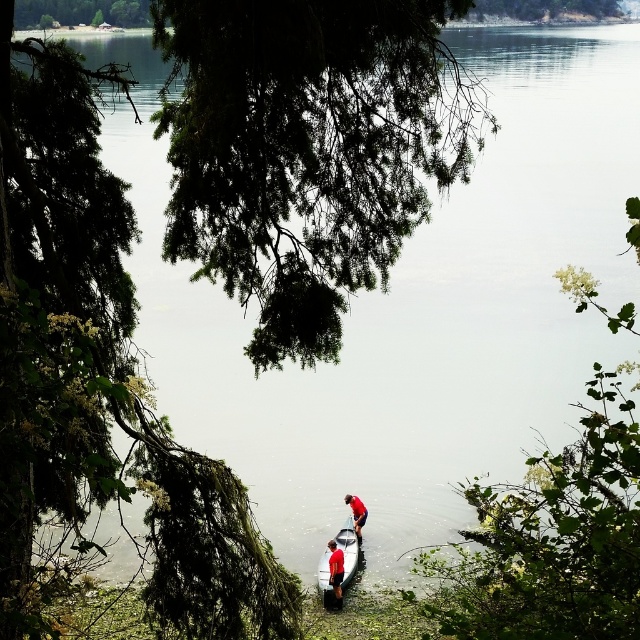
You are planning to bring a red fabric shirt at lower center into a white glossy canoe at center. Based on their sizes, will the shirt fit inside the canoe?

The white glossy canoe at center is wider than the red fabric shirt at lower center, so the shirt will fit inside the canoe.

You are standing on the lakeside and see the white glossy canoe at center and the red fabric shirt at lower center. Which object is bigger in size?

The white glossy canoe at center is larger in size compared to the red fabric shirt at lower center.